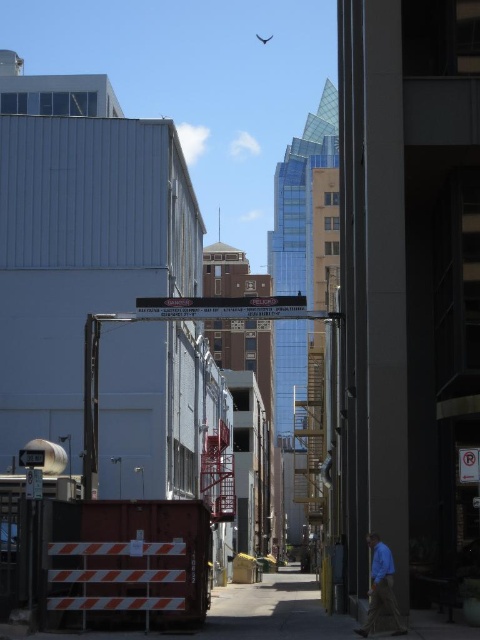
You are a delivery person trying to navigate through the alley. There is an orange striped barrier at lower left and a transparent plastic fly at upper center. Which object is positioned more to the left in the alley?

The orange striped barrier at lower left is positioned more to the left than the transparent plastic fly at upper center.